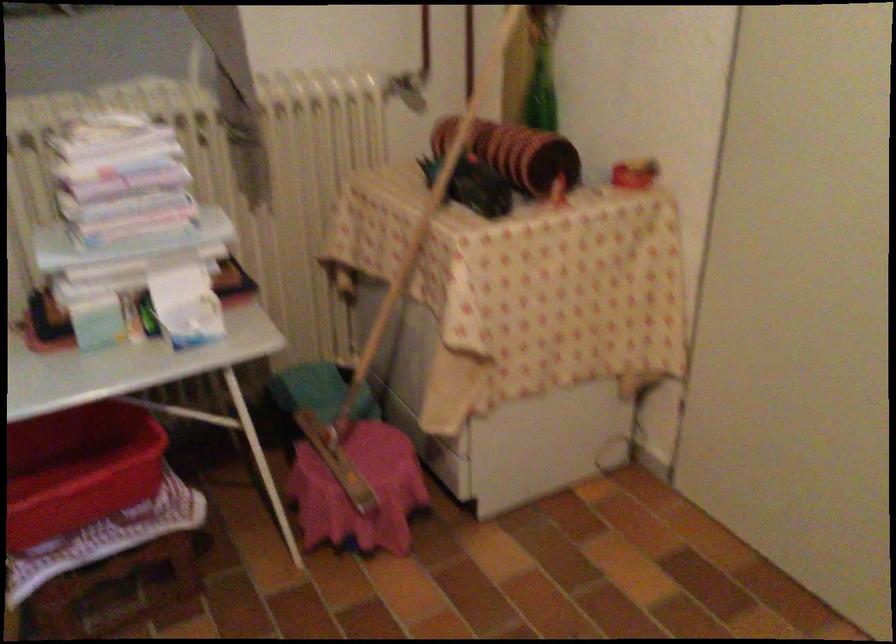
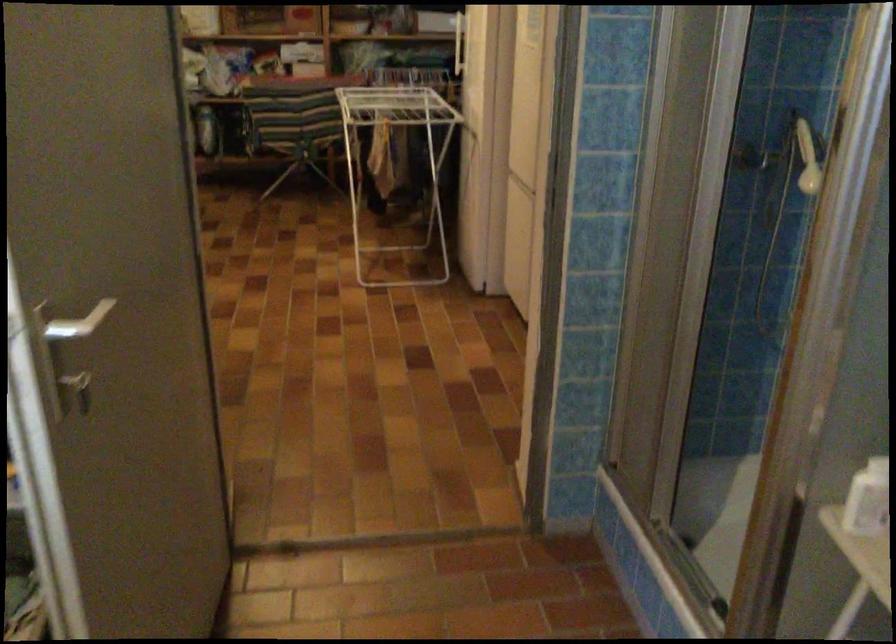
The images are taken continuously from a first-person perspective. In which direction is your viewpoint rotating?

The camera's rotation is toward left-down.